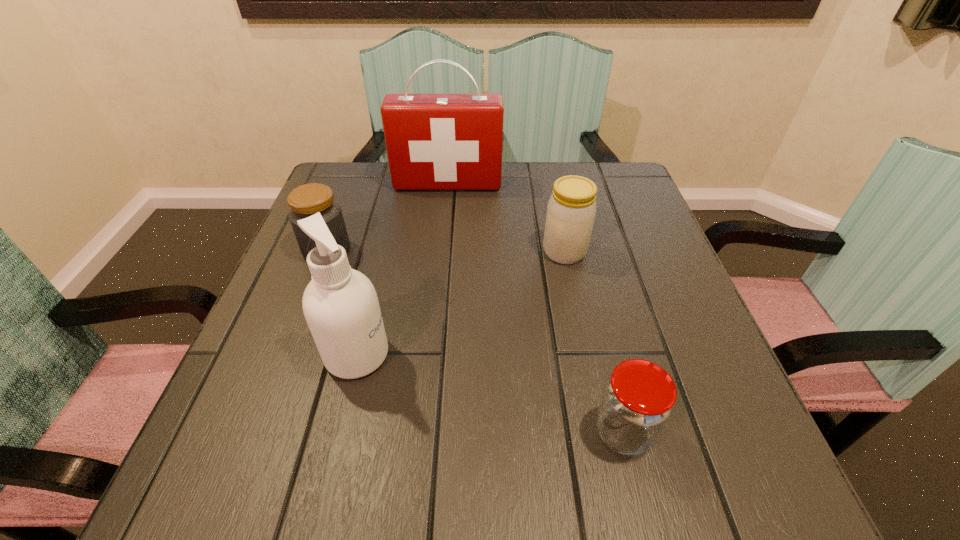
This screenshot has height=540, width=960. I want to click on vacant area in the image that satisfies the following two spatial constraints: 1. on the front label of the nearest jar; 2. on the left side of the cleansing agent, so click(x=338, y=432).

Identify the location of vacant point that satisfies the following two spatial constraints: 1. on the surface of the nearest jar near the warning symbol; 2. on the right side of the leftmost jar. (257, 432).

What are the coordinates of `free region that satisfies the following two spatial constraints: 1. on the front face of the first-aid kit; 2. on the front label of the cleansing agent` in the screenshot? It's located at (431, 355).

I want to click on blank space that satisfies the following two spatial constraints: 1. on the front label of the cleansing agent; 2. on the left side of the nearest object, so click(x=338, y=432).